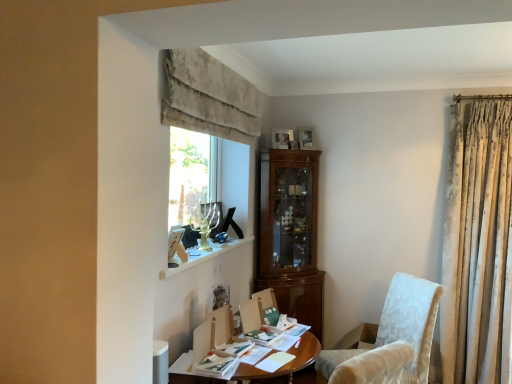
Question: Do you think white marble window sill at upper center is within wooden photo frame at upper center, which is the second picture frame in back-to-front order, or outside of it?

Choices:
 (A) outside
 (B) inside

Answer: (A)

Question: Based on their sizes in the image, would you say white marble window sill at upper center is bigger or smaller than wooden photo frame at upper center, acting as the 2th picture frame starting from the right?

Choices:
 (A) small
 (B) big

Answer: (B)

Question: Estimate the real-world distances between objects in this image. Which object is farther from the velvet beige curtain at upper center?

Choices:
 (A) wooden desk at center
 (B) wooden picture frame at upper center, which is counted as the second picture frame, starting from the front
 (C) white marble window sill at upper center
 (D) white textured fabric chair at lower right
 (E) wooden photo frame at upper center, placed as the 1th picture frame when sorted from left to right

Answer: (D)

Question: Which object is positioned farthest from the white textured fabric chair at lower right?

Choices:
 (A) velvet beige curtain at upper center
 (B) wooden photo frame at upper center, arranged as the 1th picture frame when viewed from the front
 (C) white marble window sill at upper center
 (D) wooden picture frame at upper center, which ranks as the second picture frame in left-to-right order
 (E) wooden desk at center

Answer: (A)